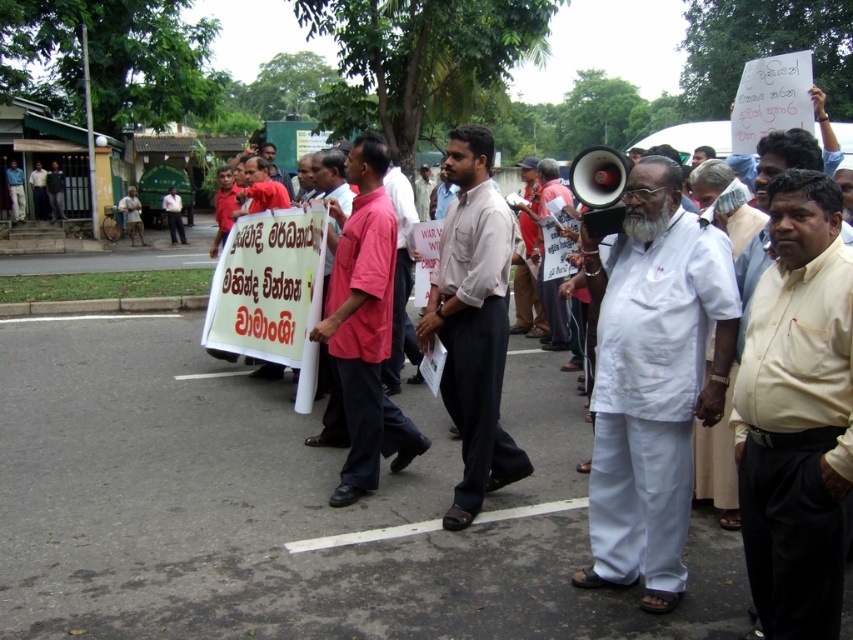
This screenshot has width=853, height=640. I want to click on beige cotton shirt at right, so click(798, 413).

Can you confirm if beige cotton shirt at right is bigger than white fabric shirt at center?

Actually, beige cotton shirt at right might be smaller than white fabric shirt at center.

Is point (831, 384) more distant than point (515, 280)?

No, (831, 384) is closer to viewer.

You are a GUI agent. You are given a task and a screenshot of the screen. Output one action in this format:
    pyautogui.click(x=<x>, y=<y>)
    Task: Click on the beige cotton shirt at right
    
    Given the screenshot: What is the action you would take?
    [x=798, y=413]

Looking at this image, between light beige shirt at center and white fabric shirt at center, which one is positioned lower?

light beige shirt at center is below.

Is light beige shirt at center shorter than white fabric shirt at center?

Indeed, light beige shirt at center has a lesser height compared to white fabric shirt at center.

Does point (492, 474) lie behind point (538, 324)?

No, it is not.

Find the location of a particular element. The image size is (853, 640). light beige shirt at center is located at coordinates (473, 323).

Is matte pink shirt at center thinner than red shirt at center?

Yes.

Who is higher up, matte pink shirt at center or red shirt at center?

red shirt at center

Measure the distance between matte pink shirt at center and camera.

The distance of matte pink shirt at center from camera is 4.48 meters.

You are a GUI agent. You are given a task and a screenshot of the screen. Output one action in this format:
    pyautogui.click(x=<x>, y=<y>)
    Task: Click on the matte pink shirt at center
    The width and height of the screenshot is (853, 640).
    Given the screenshot: What is the action you would take?
    pyautogui.click(x=364, y=324)